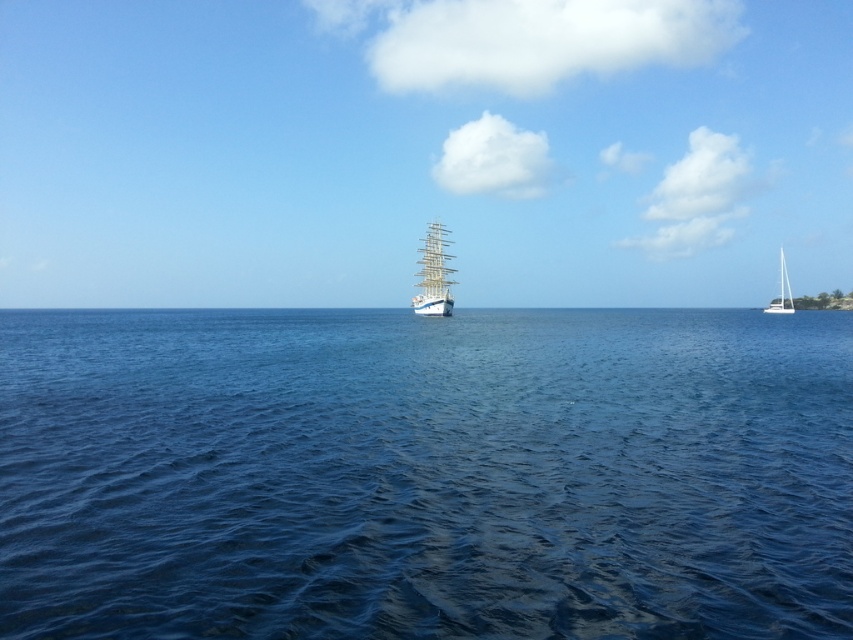
You are standing on a cliff overlooking the ocean and see the white wooden ship at center. If you have a telescope with a maximum range of 100 meters, can you see the ship clearly through it?

The white wooden ship at center is 110.36 meters away from the viewer, which exceeds the telescope maximum range of 100 meters. Therefore, you cannot see the ship clearly through the telescope.

You are an observer standing on a cliff overlooking the seascape. You notice the blue smooth water at center and the white wooden ship at center. Which of these two elements occupies a larger horizontal space in the scene?

The blue smooth water at center is wider than the white wooden ship at center, so it occupies a larger horizontal space in the scene.